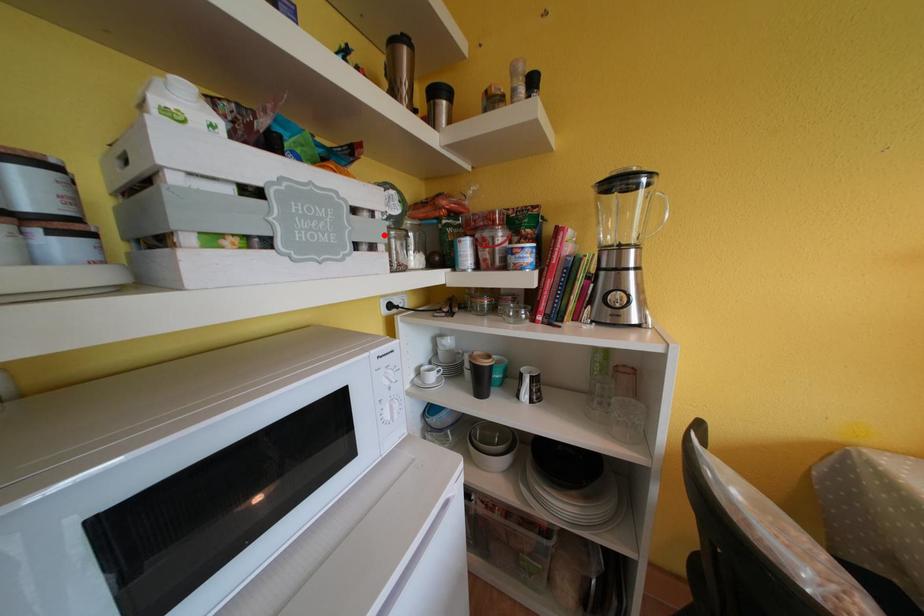
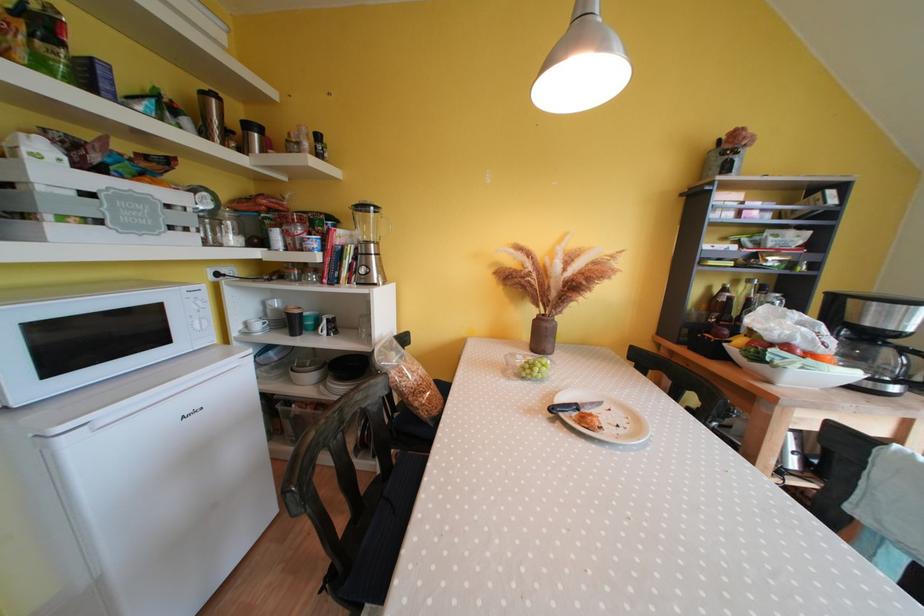
In the second image, find the point that corresponds to the highlighted location in the first image.

(196, 224)